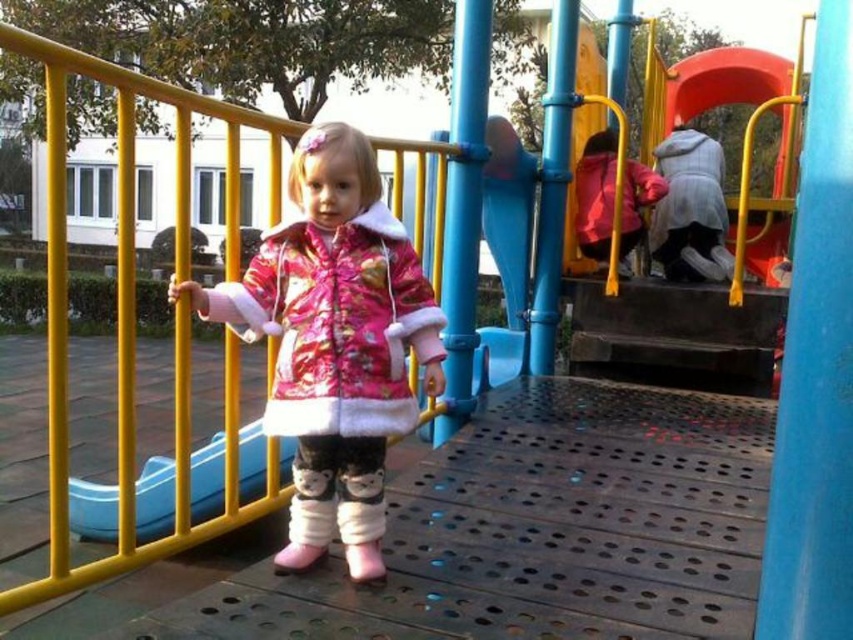
Based on the photo, you are a parent looking for your child wearing a fluffy pink coat at center and a gray fuzzy jacket at upper right. Which clothing item is closer to the ground?

The fluffy pink coat at center is closer to the ground because it is positioned under the gray fuzzy jacket at upper right.

You are a parent trying to locate your child who is wearing a fluffy pink coat at center. You see another child wearing a matte pink jacket at upper right. How far apart are the two children?

The fluffy pink coat at center is 2.28 meters from the matte pink jacket at upper right, so the two children are 2.28 meters apart.